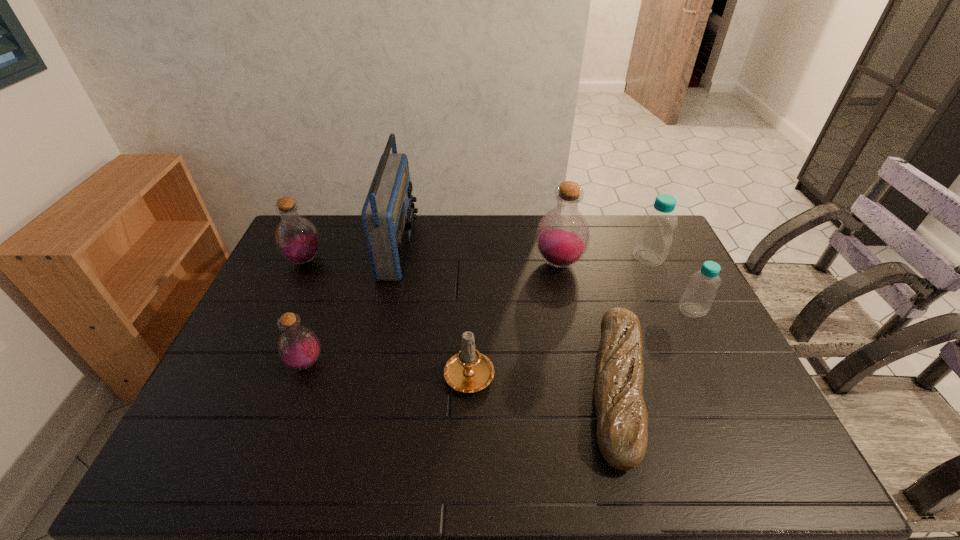
Where is `vacant space located 0.320m on the back of the shortest object`? The image size is (960, 540). vacant space located 0.320m on the back of the shortest object is located at coordinates (582, 254).

Find the location of a particular element. radio receiver located in the far edge section of the desktop is located at coordinates (388, 216).

Find the location of `object positioned at the near edge`. object positioned at the near edge is located at coordinates (622, 419).

I want to click on object that is positioned at the left edge, so pos(297,239).

Locate an element on the screen. The height and width of the screenshot is (540, 960). object present at the far left corner is located at coordinates (297, 239).

You are a GUI agent. You are given a task and a screenshot of the screen. Output one action in this format:
    pyautogui.click(x=<x>, y=<y>)
    Task: Click on the object present at the far right corner
    This screenshot has height=540, width=960.
    Given the screenshot: What is the action you would take?
    pyautogui.click(x=654, y=237)

In order to click on vacant area at the far edge in this screenshot , I will do `click(432, 247)`.

Where is `vacant space at the near edge of the desktop`? vacant space at the near edge of the desktop is located at coordinates (570, 474).

This screenshot has width=960, height=540. In the image, there is a desktop. In order to click on vacant space at the left edge in this screenshot , I will do `click(253, 369)`.

Where is `vacant region at the right edge`? The width and height of the screenshot is (960, 540). vacant region at the right edge is located at coordinates (x=732, y=416).